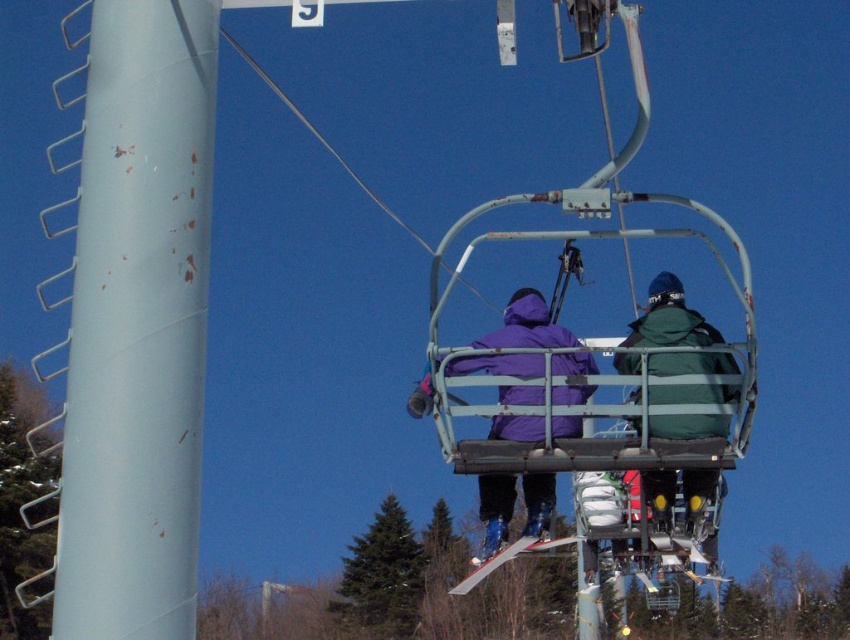
Question: Where is light blue plastic pole at left located in relation to green matte jacket at center in the image?

Choices:
 (A) right
 (B) left

Answer: (B)

Question: Which point is farther from the camera taking this photo?

Choices:
 (A) (451, 589)
 (B) (132, 77)
 (C) (700, 516)

Answer: (A)

Question: Is purple matte jacket at center positioned at the back of white plastic ski at center?

Choices:
 (A) no
 (B) yes

Answer: (A)

Question: Does green matte jacket at center come behind white plastic ski at center?

Choices:
 (A) no
 (B) yes

Answer: (A)

Question: Which is nearer to the light blue plastic pole at left?

Choices:
 (A) purple matte jacket at center
 (B) green matte jacket at center
 (C) white plastic ski at center

Answer: (A)

Question: Which point is farther to the camera?

Choices:
 (A) green matte jacket at center
 (B) white plastic ski at center
 (C) light blue plastic pole at left
 (D) purple matte jacket at center

Answer: (B)